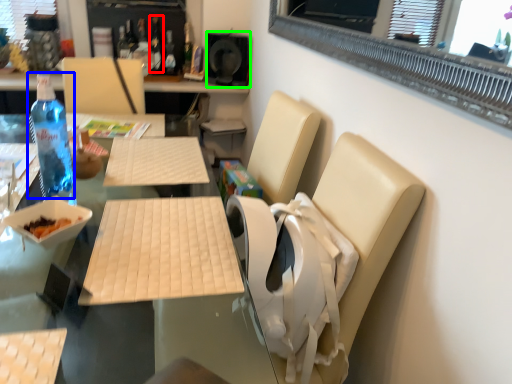
Question: Based on their relative distances, which object is nearer to bottle (highlighted by a red box)? Choose from bottle (highlighted by a blue box) and speaker (highlighted by a green box).

Choices:
 (A) bottle
 (B) speaker

Answer: (B)